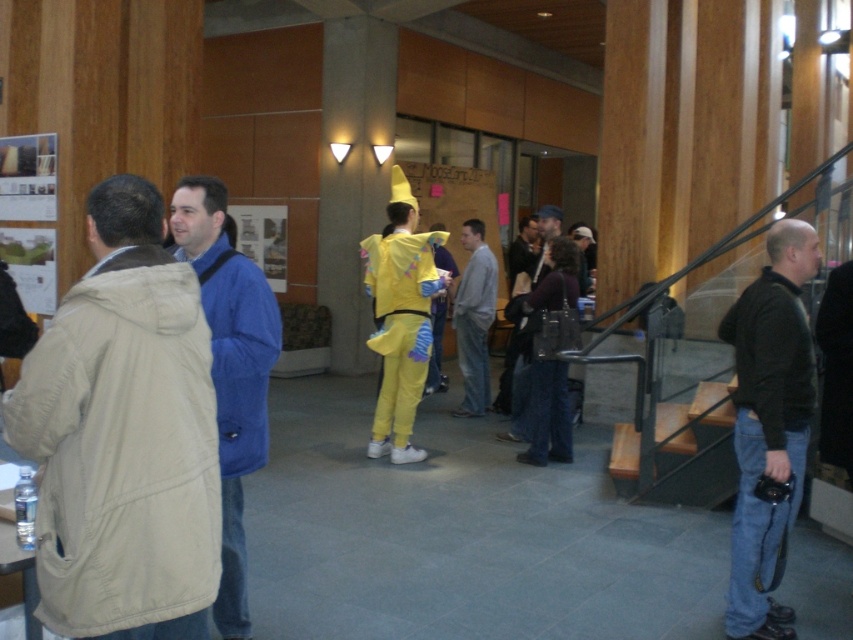
Can you confirm if blue fabric jacket at center is wider than wooden at right?

No, blue fabric jacket at center is not wider than wooden at right.

Who is higher up, blue fabric jacket at center or wooden at right?

blue fabric jacket at center is above.

Describe the element at coordinates (230, 368) in the screenshot. I see `blue fabric jacket at center` at that location.

I want to click on blue fabric jacket at center, so click(230, 368).

Does dark gray sweater at right appear on the left side of blue fabric jacket at center?

Incorrect, dark gray sweater at right is not on the left side of blue fabric jacket at center.

Which is more to the left, dark gray sweater at right or blue fabric jacket at center?

From the viewer's perspective, blue fabric jacket at center appears more on the left side.

Is point (807, 413) closer to camera compared to point (231, 456)?

No, (807, 413) is behind (231, 456).

Identify the location of dark gray sweater at right. The height and width of the screenshot is (640, 853). (769, 422).

Looking at this image, between blue fabric jacket at center and gray cotton sweatshirt at center, which one has more height?

With more height is gray cotton sweatshirt at center.

Between point (239, 586) and point (477, 401), which one is positioned behind?

The point (477, 401) is more distant.

I want to click on blue fabric jacket at center, so click(230, 368).